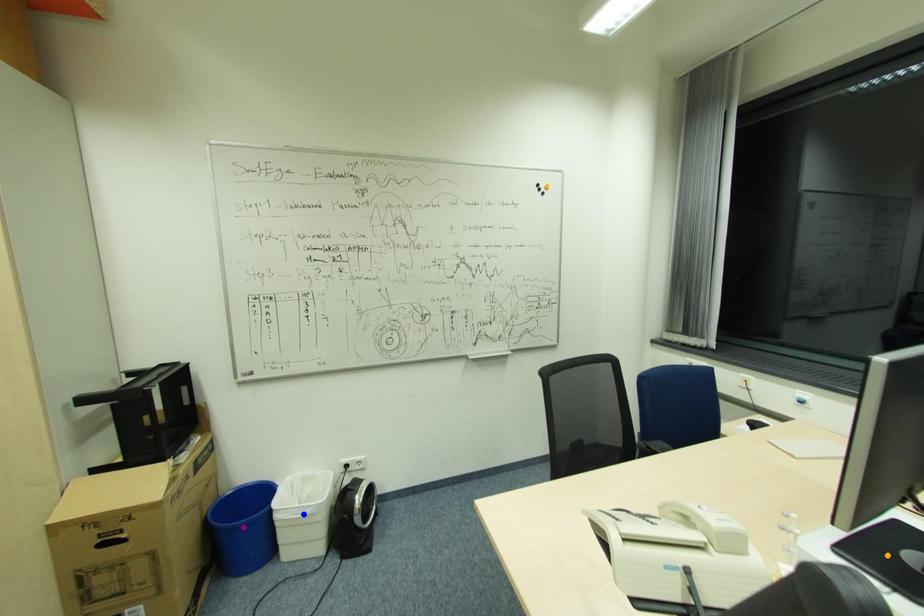
Order these from nearest to farthest:
A) orange point
B) purple point
C) blue point

orange point → purple point → blue point